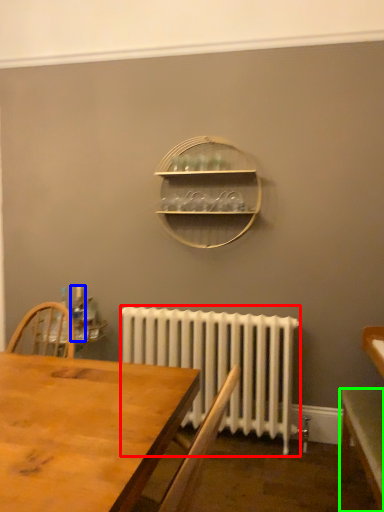
Question: Which object is positioned farthest from radiator (highlighted by a red box)? Select from bottle (highlighted by a blue box) and table (highlighted by a green box).

Choices:
 (A) bottle
 (B) table

Answer: (A)